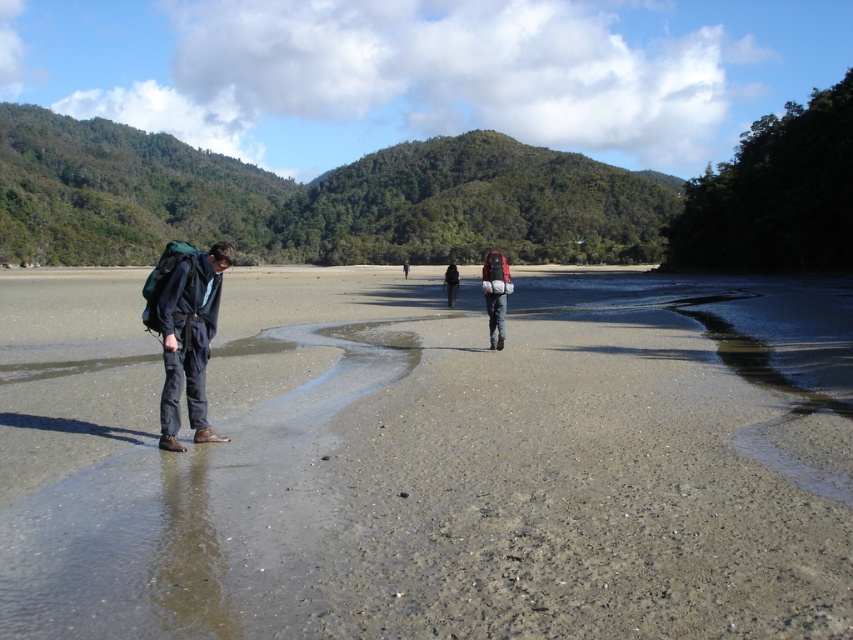
You are planning to set up a small tent for a quick rest. Given the available space, can you place the tent on the sandy beach at lower left without overlapping the matte black backpack at center?

The sandy beach at lower left is larger in size than the matte black backpack at center, so there should be enough space to place the tent on the sandy beach at lower left without overlapping the backpack.

You are a photographer trying to capture a photo of the dark blue fabric pants at left and the sandy beach at lower left. Based on their positions, which object should you focus on first to ensure both are in the frame?

The sandy beach at lower left is positioned on the left side of dark blue fabric pants at left, so you should focus on the sandy beach at lower left first to ensure both are in the frame.